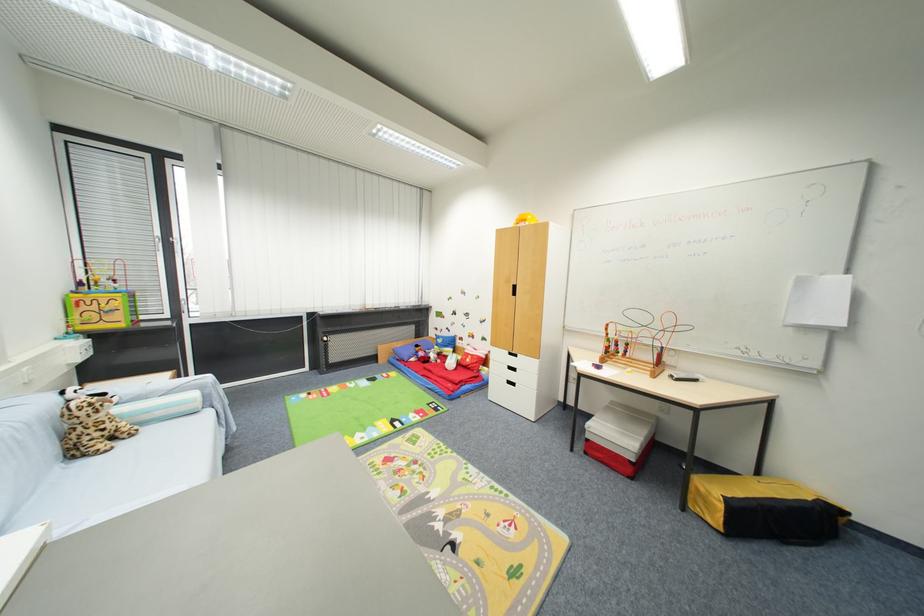
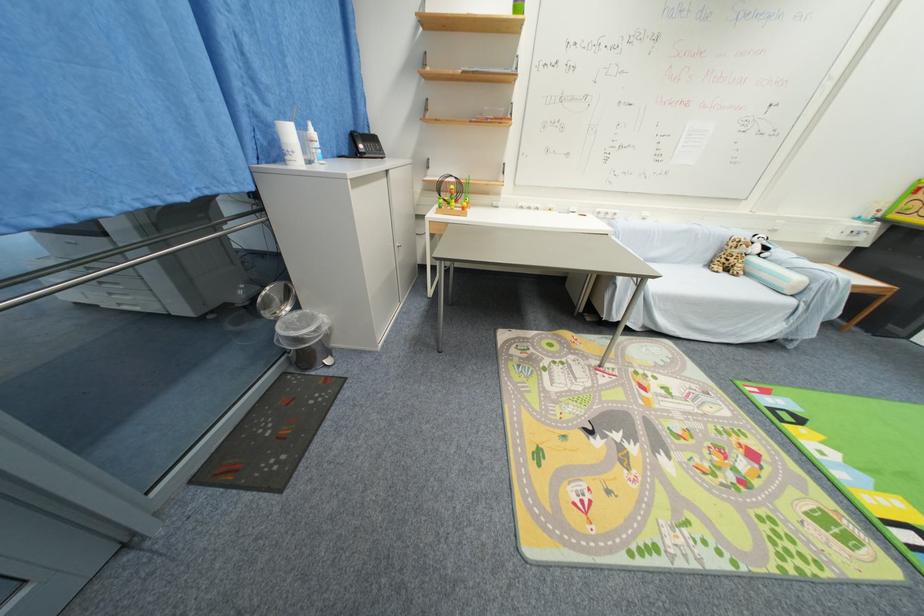
The point at (125, 446) is marked in the first image. Where is the corresponding point in the second image?

(730, 276)